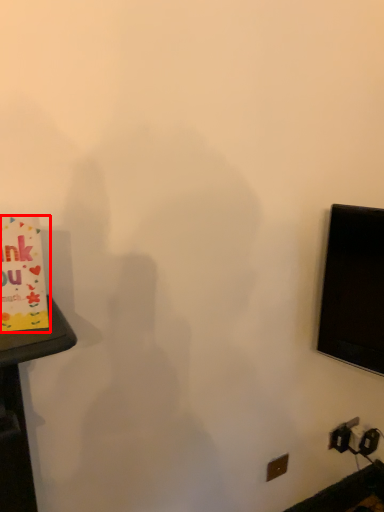
Question: Where is birthday card (annotated by the red box) located in relation to electric outlet in the image?

Choices:
 (A) right
 (B) left

Answer: (B)